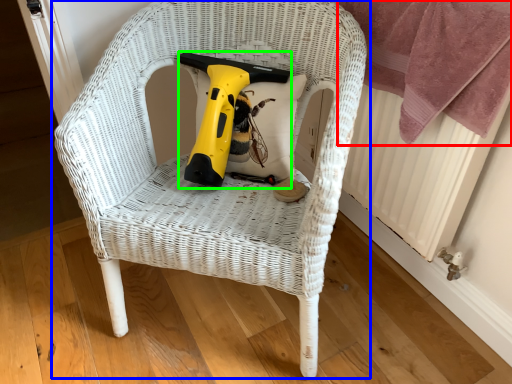
Question: Which object is positioned farthest from blanket (highlighted by a red box)? Select from chair (highlighted by a blue box) and electric drill (highlighted by a green box).

Choices:
 (A) chair
 (B) electric drill

Answer: (B)